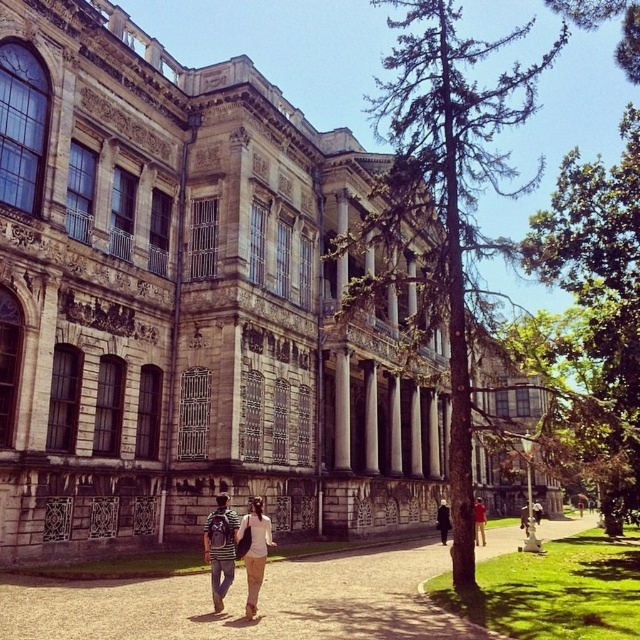
Describe the element at coordinates (480, 522) in the screenshot. I see `brown leather jacket at center` at that location.

What do you see at coordinates (480, 522) in the screenshot? I see `brown leather jacket at center` at bounding box center [480, 522].

Identify the location of brown leather jacket at center. (480, 522).

In the scene shown: Does striped fabric backpack at center appear under brown leather jacket at center?

No, striped fabric backpack at center is not below brown leather jacket at center.

The width and height of the screenshot is (640, 640). What do you see at coordinates (220, 548) in the screenshot?
I see `striped fabric backpack at center` at bounding box center [220, 548].

Find the location of a particular element. The height and width of the screenshot is (640, 640). striped fabric backpack at center is located at coordinates (220, 548).

Is striped fabric backpack at center above dark brown leather jacket at center?

Correct, striped fabric backpack at center is located above dark brown leather jacket at center.

Which of these two, striped fabric backpack at center or dark brown leather jacket at center, stands shorter?

With less height is dark brown leather jacket at center.

Is point (227, 577) closer to viewer compared to point (442, 538)?

Yes, point (227, 577) is in front of point (442, 538).

Where is `striped fabric backpack at center`? striped fabric backpack at center is located at coordinates (220, 548).